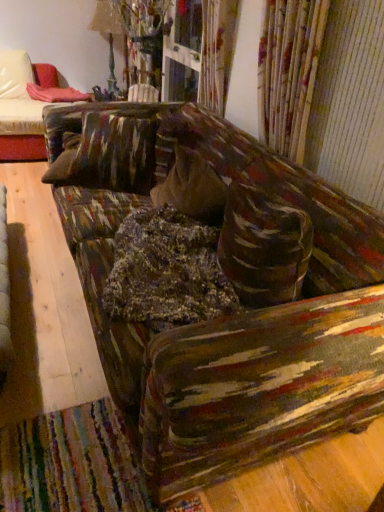
Question: Should I look upward or downward to see pink fabric at upper left?

Choices:
 (A) down
 (B) up

Answer: (B)

Question: Can you confirm if pink fabric at upper left is wider than textured multicolored couch at center?

Choices:
 (A) no
 (B) yes

Answer: (A)

Question: Can you confirm if pink fabric at upper left is thinner than textured multicolored couch at center?

Choices:
 (A) no
 (B) yes

Answer: (B)

Question: From a real-world perspective, is pink fabric at upper left positioned over textured multicolored couch at center based on gravity?

Choices:
 (A) no
 (B) yes

Answer: (B)

Question: Is pink fabric at upper left touching textured multicolored couch at center?

Choices:
 (A) yes
 (B) no

Answer: (B)

Question: Does pink fabric at upper left contain textured multicolored couch at center?

Choices:
 (A) no
 (B) yes

Answer: (A)

Question: Is pink fabric at upper left bigger than textured multicolored couch at center?

Choices:
 (A) yes
 (B) no

Answer: (B)

Question: Does textured multicolored couch at center have a greater width compared to pink fabric at upper left?

Choices:
 (A) no
 (B) yes

Answer: (B)

Question: Is there a large distance between textured multicolored couch at center and pink fabric at upper left?

Choices:
 (A) yes
 (B) no

Answer: (A)

Question: Is textured multicolored couch at center at the right side of pink fabric at upper left?

Choices:
 (A) yes
 (B) no

Answer: (A)

Question: From the image's perspective, does textured multicolored couch at center appear higher than pink fabric at upper left?

Choices:
 (A) yes
 (B) no

Answer: (B)

Question: Can you confirm if textured multicolored couch at center is taller than pink fabric at upper left?

Choices:
 (A) yes
 (B) no

Answer: (B)

Question: Can you confirm if textured multicolored couch at center is bigger than pink fabric at upper left?

Choices:
 (A) yes
 (B) no

Answer: (A)

Question: From a real-world perspective, relative to textured multicolored couch at center, is pink fabric at upper left vertically above or below?

Choices:
 (A) below
 (B) above

Answer: (B)